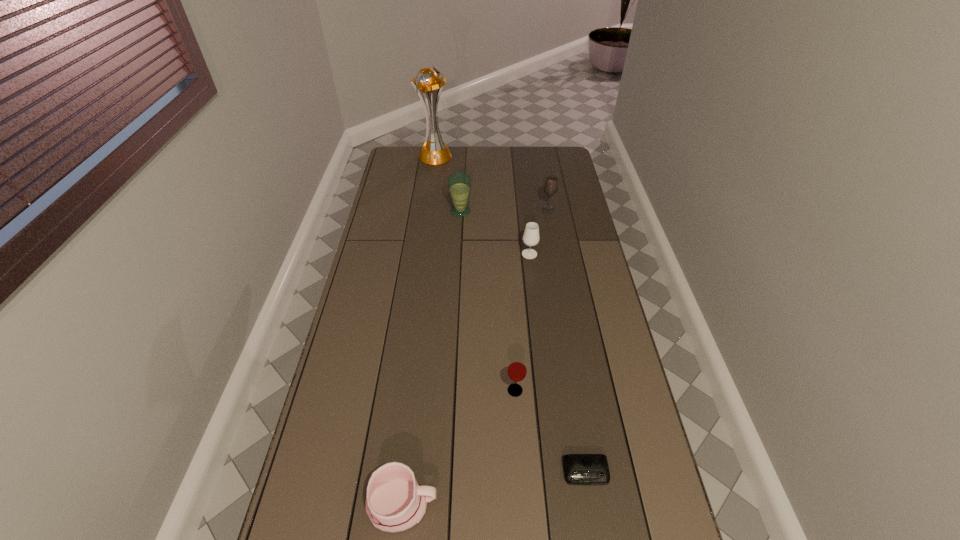
Find the location of a particular element. The image size is (960, 540). vacant space that's between the alarm clock and the sixth tallest object is located at coordinates (494, 489).

The width and height of the screenshot is (960, 540). Identify the location of vacant area that lies between the leftmost glass and the mug. (431, 359).

Locate an element on the screen. This screenshot has height=540, width=960. vacant area that lies between the farthest object and the nearest glass is located at coordinates (475, 273).

You are a GUI agent. You are given a task and a screenshot of the screen. Output one action in this format:
    pyautogui.click(x=<x>, y=<y>)
    Task: Click on the free area in between the tallest object and the nearest glass
    The height and width of the screenshot is (540, 960).
    Given the screenshot: What is the action you would take?
    pyautogui.click(x=475, y=273)

Locate an element on the screen. unoccupied area between the mug and the alarm clock is located at coordinates (494, 489).

Point out which object is positioned as the fourth nearest to the mug. Please provide its 2D coordinates. Your answer should be formatted as a tuple, i.e. [(x, y)], where the tuple contains the x and y coordinates of a point satisfying the conditions above.

[(459, 184)]

Identify which object is the nearest to the rightmost glass. Please provide its 2D coordinates. Your answer should be formatted as a tuple, i.e. [(x, y)], where the tuple contains the x and y coordinates of a point satisfying the conditions above.

[(531, 237)]

Select which glass appears as the third closest to the tallest object. Please provide its 2D coordinates. Your answer should be formatted as a tuple, i.e. [(x, y)], where the tuple contains the x and y coordinates of a point satisfying the conditions above.

[(531, 237)]

Image resolution: width=960 pixels, height=540 pixels. I want to click on glass that is the closest to the farthest object, so click(459, 184).

Image resolution: width=960 pixels, height=540 pixels. In order to click on vacant space that satisfies the following two spatial constraints: 1. on the front side of the leftmost glass; 2. on the side with the handle of the mug in this screenshot , I will do `click(445, 505)`.